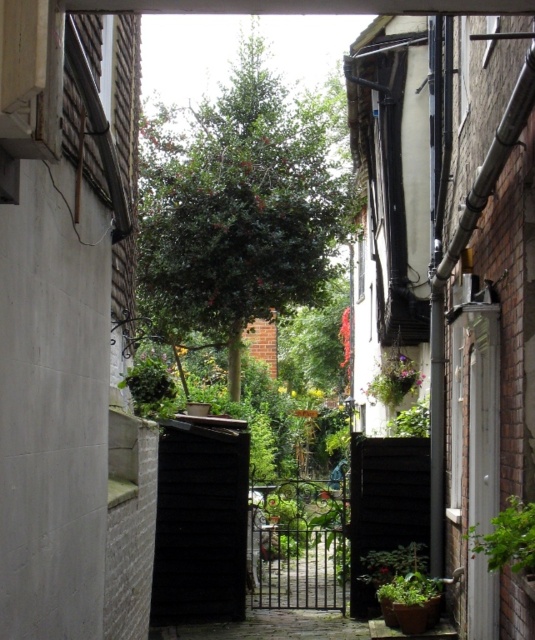
You are a delivery robot with a width of 0.8 meters. You need to navigate through the narrow alleyway to reach the garden. There are two plants in your path. Can you pass between the green leafy plant at right and the green matte plant at lower right without touching them?

The green leafy plant at right is positioned on the left side of the green matte plant at lower right. Since the alleyway is narrow and the plants are positioned next to each other, the distance between them may be insufficient for the robot to pass through safely. The robot should consider an alternative route or reposition the plants to ensure adequate space.

You are a window cleaner standing on a ladder in the alley. You need to reach the pink fabric hanging at center and the green leafy plant at right. Which object is closer to your current position on the ladder?

The green leafy plant at right is located below the pink fabric hanging at center, so it is closer to your current position on the ladder.